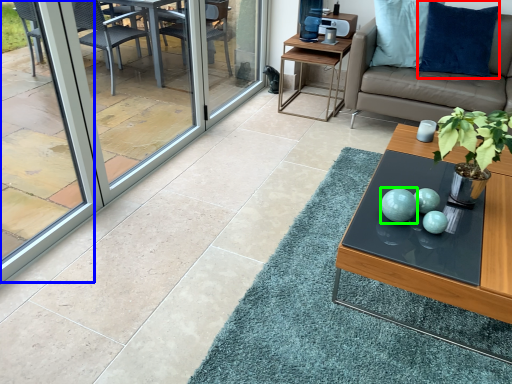
Question: Based on their relative distances, which object is nearer to pillow (highlighted by a red box)? Choose from window screen (highlighted by a blue box) and turquoise (highlighted by a green box).

Choices:
 (A) window screen
 (B) turquoise

Answer: (B)